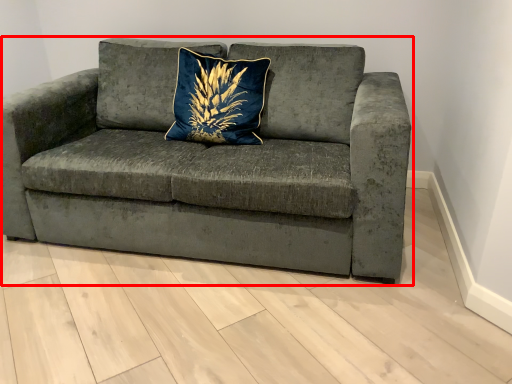
Question: From the image's perspective, where is studio couch (annotated by the red box) located in relation to pillow in the image?

Choices:
 (A) above
 (B) below

Answer: (B)